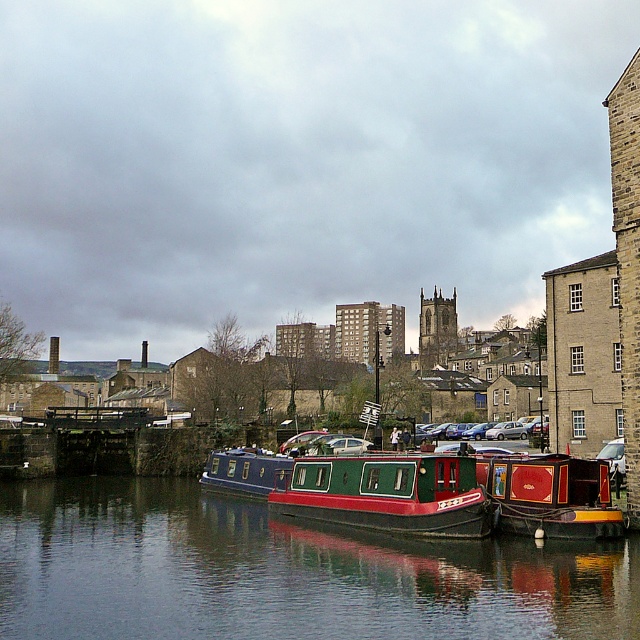
Question: Is smooth black water at center to the right of red glossy barge at center from the viewer's perspective?

Choices:
 (A) yes
 (B) no

Answer: (B)

Question: Can you confirm if smooth black water at center is bigger than red polished wood barge at lower right?

Choices:
 (A) no
 (B) yes

Answer: (B)

Question: Does smooth black water at center appear over red glossy barge at center?

Choices:
 (A) no
 (B) yes

Answer: (A)

Question: Among these objects, which one is farthest from the camera?

Choices:
 (A) red polished wood barge at lower right
 (B) red glossy barge at center

Answer: (B)

Question: Which of the following is the farthest from the observer?

Choices:
 (A) (502, 497)
 (B) (296, 573)

Answer: (A)

Question: Which object appears farthest from the camera in this image?

Choices:
 (A) smooth black water at center
 (B) red glossy barge at center
 (C) red polished wood barge at lower right

Answer: (B)